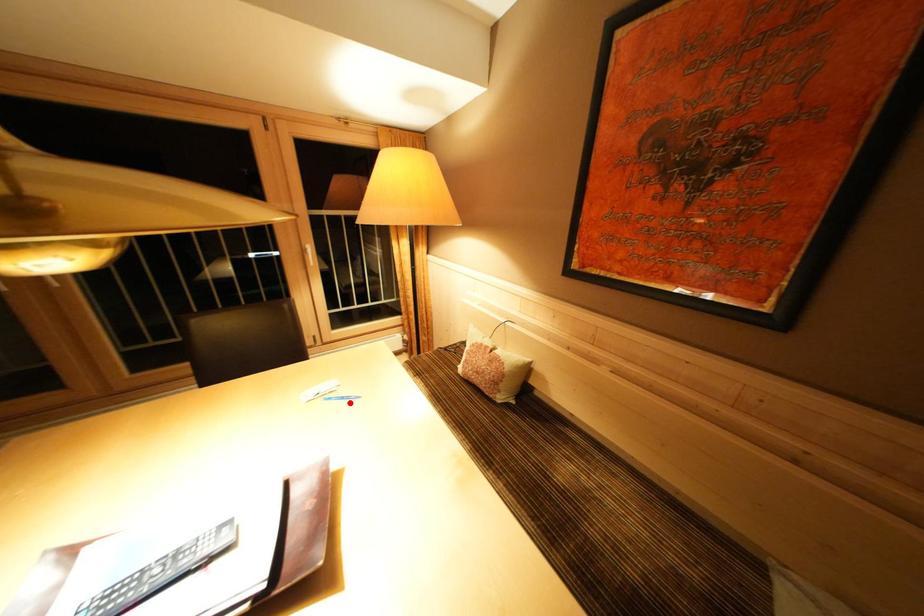
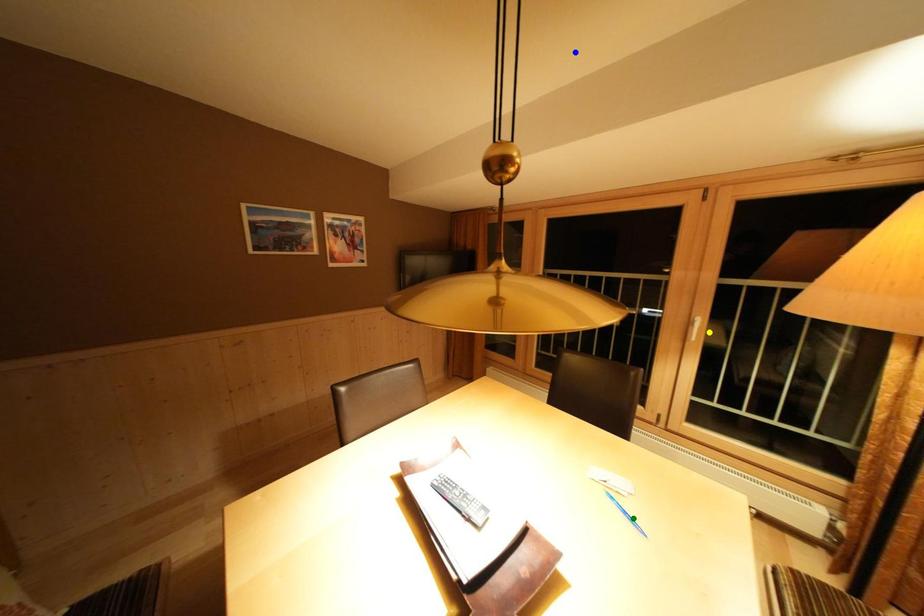
Question: I am providing you with two images of the same scene from different viewpoints. A red point is marked on the first image. You are given multiple points on the second image. In image 2, which mark is for the same physical point as the one in image 1?

Choices:
 (A) blue point
 (B) green point
 (C) yellow point

Answer: (B)